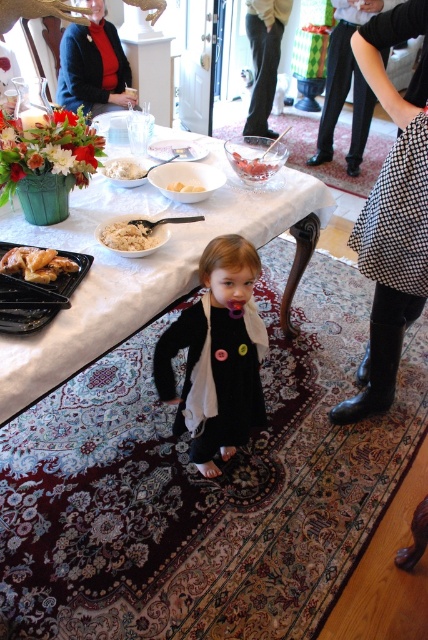
Which of these two, black houndstooth skirt at lower right or white rice at center, stands shorter?

white rice at center

The image size is (428, 640). I want to click on black houndstooth skirt at lower right, so click(x=392, y=211).

The width and height of the screenshot is (428, 640). Find the location of `black houndstooth skirt at lower right`. black houndstooth skirt at lower right is located at coordinates (392, 211).

Between black houndstooth skirt at lower right and black plastic tray at lower left, which one appears on the left side from the viewer's perspective?

black plastic tray at lower left

Is point (374, 353) less distant than point (23, 285)?

No, (374, 353) is behind (23, 285).

Find the location of a particular element. This screenshot has height=640, width=428. black houndstooth skirt at lower right is located at coordinates (392, 211).

Which of these two, white fabric table at center or matte black blazer at upper left, stands shorter?

Standing shorter between the two is matte black blazer at upper left.

Can you confirm if white fabric table at center is smaller than matte black blazer at upper left?

Actually, white fabric table at center might be larger than matte black blazer at upper left.

Which is behind, point (76, 243) or point (122, 90)?

The point (122, 90) is more distant.

In order to click on white fabric table at center in this screenshot , I will do click(x=142, y=269).